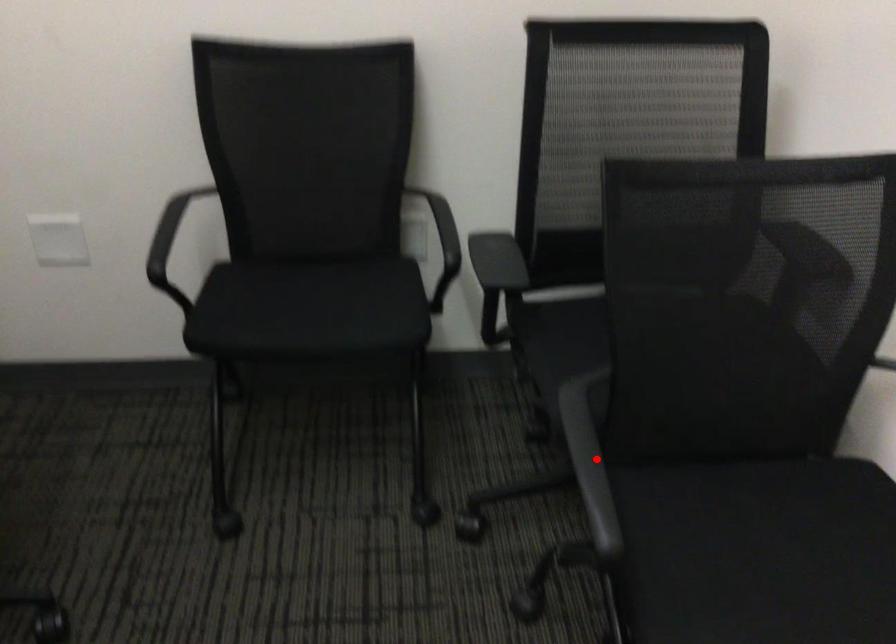
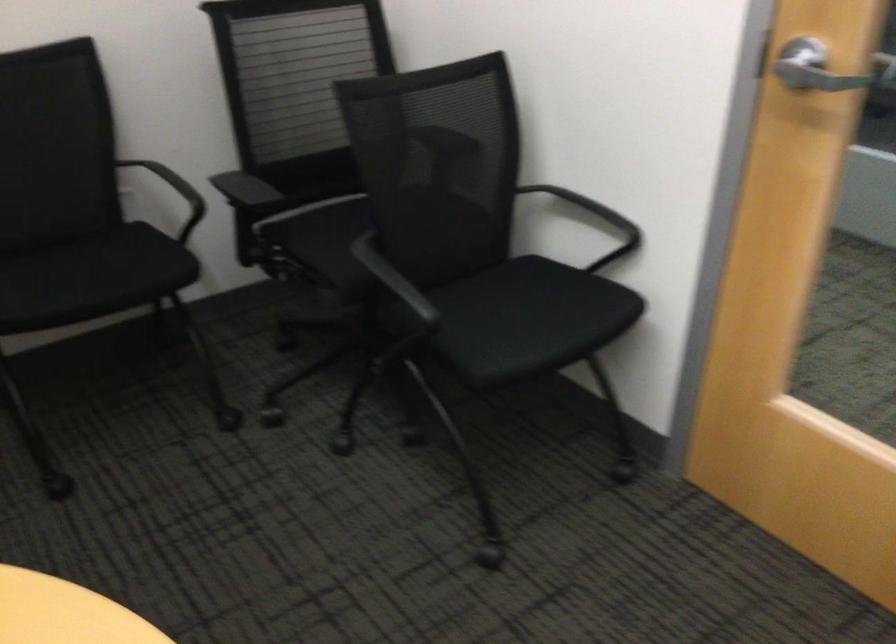
In the second image, find the point that corresponds to the highlighted location in the first image.

(392, 278)